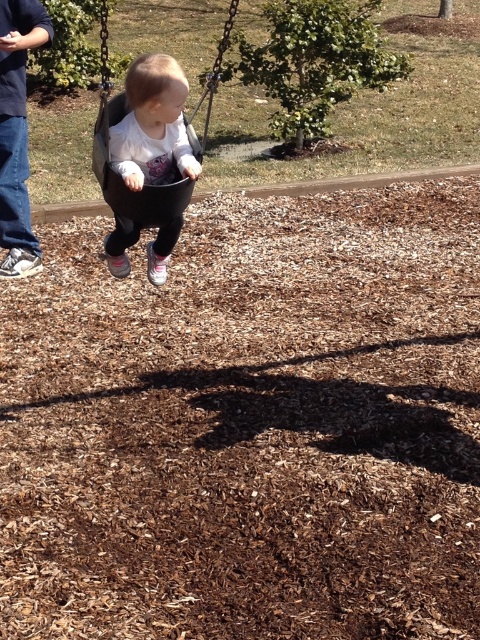
Which is above, matte black swing at center or denim pants at left?

denim pants at left is higher up.

Which is behind, point (153, 163) or point (29, 246)?

The point (29, 246) is more distant.

Image resolution: width=480 pixels, height=640 pixels. What are the coordinates of `matte black swing at center` in the screenshot? It's located at (153, 125).

Can you confirm if denim pants at left is shorter than black plastic swing at center?

Yes.

Does denim pants at left have a greater height compared to black plastic swing at center?

In fact, denim pants at left may be shorter than black plastic swing at center.

Is point (12, 264) positioned in front of point (103, 150)?

No.

At what (x,y) coordinates should I click in order to perform the action: click on denim pants at left. Please return your answer as a coordinate pair (x, y). The height and width of the screenshot is (640, 480). Looking at the image, I should click on (16, 132).

Who is positioned more to the left, matte black swing at center or black plastic swing at center?

black plastic swing at center

Is point (181, 84) positioned behind point (211, 74)?

That is False.

You are a GUI agent. You are given a task and a screenshot of the screen. Output one action in this format:
    pyautogui.click(x=<x>, y=<y>)
    Task: Click on the matte black swing at center
    Image resolution: width=480 pixels, height=640 pixels.
    Given the screenshot: What is the action you would take?
    pyautogui.click(x=153, y=125)